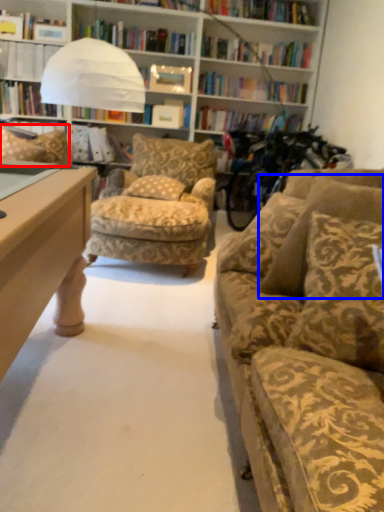
Question: Which object appears closest to the camera in this image, pillow (highlighted by a red box) or pillow (highlighted by a blue box)?

Choices:
 (A) pillow
 (B) pillow

Answer: (B)